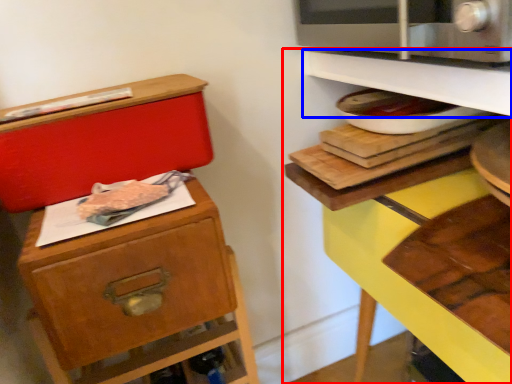
Question: Which object appears farthest to the camera in this image, shelf (highlighted by a red box) or shelf (highlighted by a blue box)?

Choices:
 (A) shelf
 (B) shelf

Answer: (B)